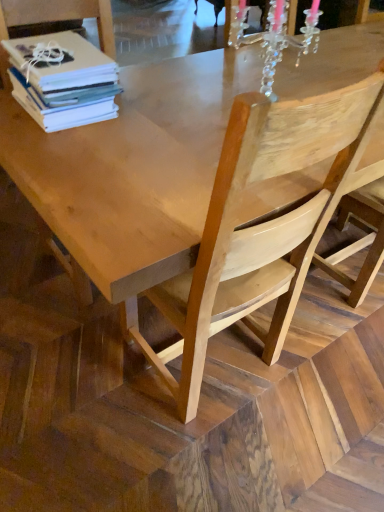
What are the coordinates of `vacant space that is to the left of natural wood chair at center, the second chair in the right-to-left sequence` in the screenshot? It's located at (72, 369).